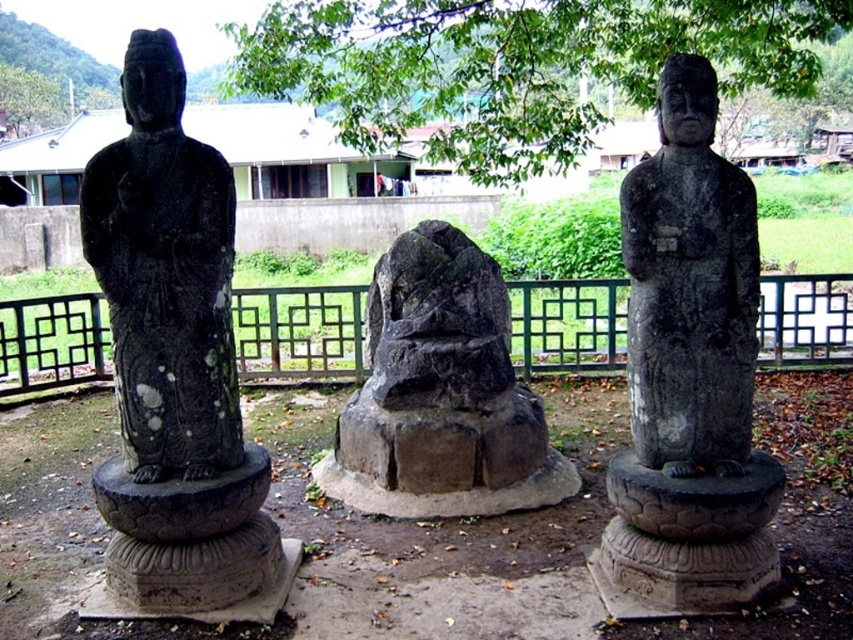
Question: Which object is closer to the camera taking this photo?

Choices:
 (A) black stone statue at left
 (B) green leafy tree at center
 (C) black stone statue at center

Answer: (A)

Question: Which point is closer to the camera?

Choices:
 (A) (570, 342)
 (B) (206, 275)
 (C) (718, 438)

Answer: (B)

Question: Does black stone statue at left lie in front of green leafy tree at center?

Choices:
 (A) no
 (B) yes

Answer: (B)

Question: Does green leafy tree at center come in front of black stone statue at center?

Choices:
 (A) yes
 (B) no

Answer: (B)

Question: Which of these objects is positioned closest to the black stone statue at center?

Choices:
 (A) black stone statue at left
 (B) black metal fence at center

Answer: (A)

Question: From the image, what is the correct spatial relationship of black stone statue at left in relation to black stone statue at center?

Choices:
 (A) right
 (B) left

Answer: (B)